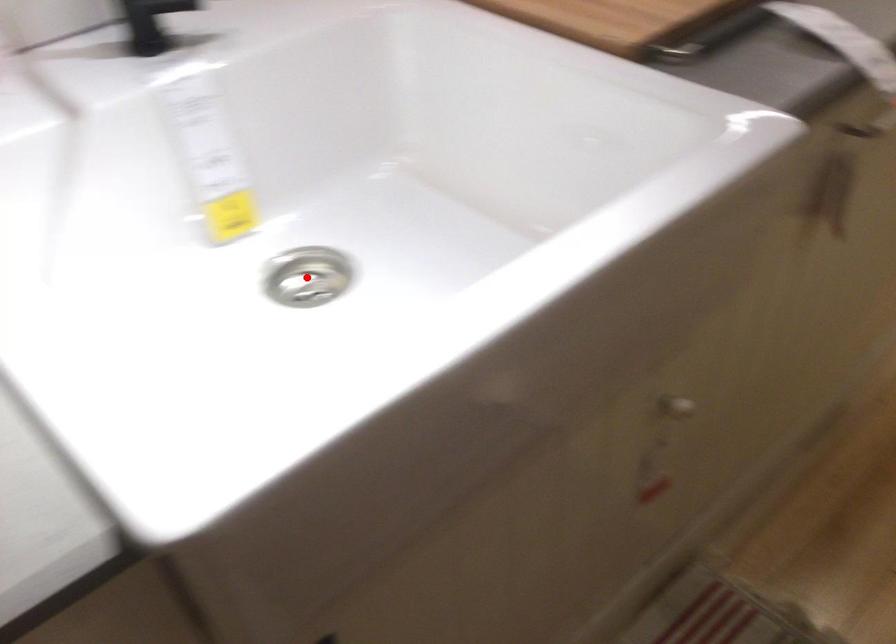
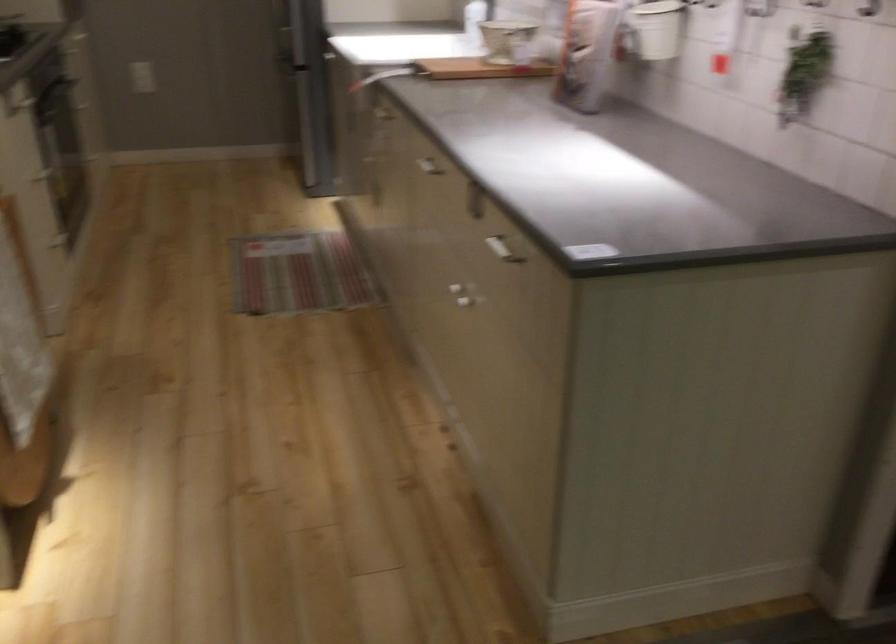
Question: I am providing you with two images of the same scene from different viewpoints. A red point is marked on the first image. At the location where the point appears in image 1, is it still visible in image 2?

Choices:
 (A) Yes
 (B) No

Answer: (B)